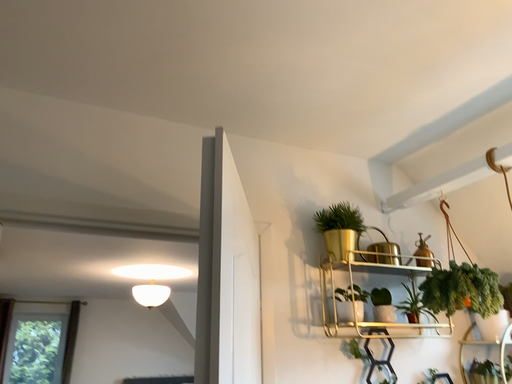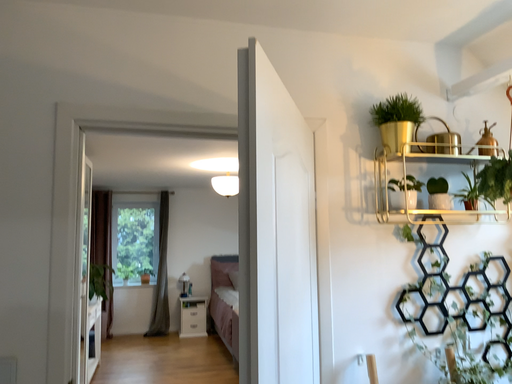
Question: How did the camera likely rotate when shooting the video?

Choices:
 (A) rotated downward
 (B) rotated upward

Answer: (A)